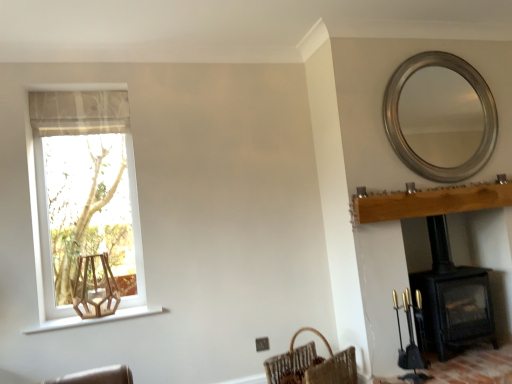
This screenshot has height=384, width=512. In order to click on wooden hexagonal swivel chair at lower left in this screenshot , I will do `click(95, 288)`.

What do you see at coordinates (441, 116) in the screenshot? I see `silver metallic mirror at upper right` at bounding box center [441, 116].

Locate an element on the screen. This screenshot has height=384, width=512. wooden hexagonal swivel chair at lower left is located at coordinates (95, 288).

Can you tell me how much brown woven basket at lower right and translucent fabric at left differ in facing direction?

They differ by 32.6 degrees in their facing directions.

From a real-world perspective, is brown woven basket at lower right physically below translucent fabric at left?

Yes, from a real-world perspective, brown woven basket at lower right is beneath translucent fabric at left.

Between brown woven basket at lower right and translucent fabric at left, which one is positioned behind?

translucent fabric at left is further from the camera.

In terms of width, does brown woven basket at lower right look wider or thinner when compared to translucent fabric at left?

Considering their sizes, brown woven basket at lower right looks broader than translucent fabric at left.

Is silver metallic mirror at upper right inside or outside of black matte wood burning stove at lower right?

silver metallic mirror at upper right cannot be found inside black matte wood burning stove at lower right.

Does silver metallic mirror at upper right lie in front of black matte wood burning stove at lower right?

No, silver metallic mirror at upper right is behind black matte wood burning stove at lower right.

Is point (415, 103) closer to viewer compared to point (417, 334)?

No, it is not.

This screenshot has width=512, height=384. Find the location of `mirror lying on the left of black matte wood burning stove at lower right`. mirror lying on the left of black matte wood burning stove at lower right is located at coordinates (441, 116).

Is black matte wood burning stove at lower right completely or partially outside of brown woven basket at lower right?

Absolutely, black matte wood burning stove at lower right is external to brown woven basket at lower right.

From the picture: From a real-world perspective, which object rests below the other?

brown woven basket at lower right.

Could you measure the distance between black matte wood burning stove at lower right and brown woven basket at lower right?

black matte wood burning stove at lower right and brown woven basket at lower right are 83.53 centimeters apart.

How different are the orientations of black matte wood burning stove at lower right and brown woven basket at lower right in degrees?

The angle between the facing direction of black matte wood burning stove at lower right and the facing direction of brown woven basket at lower right is 32.6 degrees.

Is brown woven basket at lower right further to camera compared to wooden hexagonal swivel chair at lower left?

No, brown woven basket at lower right is closer to the camera.

From the image's perspective, does brown woven basket at lower right appear higher than wooden hexagonal swivel chair at lower left?

No.

Can you see brown woven basket at lower right touching wooden hexagonal swivel chair at lower left?

No, brown woven basket at lower right is not making contact with wooden hexagonal swivel chair at lower left.

Does point (141, 283) come in front of point (441, 204)?

Yes.

Is translucent fabric at left inside or outside of light brown wood mantle at upper right?

translucent fabric at left is outside light brown wood mantle at upper right.

Considering the sizes of objects translucent fabric at left and light brown wood mantle at upper right in the image provided, who is thinner, translucent fabric at left or light brown wood mantle at upper right?

light brown wood mantle at upper right.

Is translucent fabric at left not near black matte wood burning stove at lower right?

translucent fabric at left is positioned a significant distance from black matte wood burning stove at lower right.

Between translucent fabric at left and black matte wood burning stove at lower right, which one has larger size?

translucent fabric at left is bigger.

Based on the photo, from a real-world perspective, which object rests below the other?

black matte wood burning stove at lower right.

Image resolution: width=512 pixels, height=384 pixels. I want to click on window that appears above the black matte wood burning stove at lower right (from the image's perspective), so click(83, 198).

Between light brown wood mantle at upper right and black matte wood burning stove at lower right, which one appears on the right side from the viewer's perspective?

black matte wood burning stove at lower right is more to the right.

From a real-world perspective, is light brown wood mantle at upper right physically located above or below black matte wood burning stove at lower right?

light brown wood mantle at upper right is above black matte wood burning stove at lower right.

Is the position of light brown wood mantle at upper right less distant than that of black matte wood burning stove at lower right?

Yes, light brown wood mantle at upper right is closer to the camera.

This screenshot has width=512, height=384. Find the location of `mantle that is in front of the black matte wood burning stove at lower right`. mantle that is in front of the black matte wood burning stove at lower right is located at coordinates (430, 201).

In order to click on window located above the brown woven basket at lower right (from the image's perspective) in this screenshot , I will do `click(83, 198)`.

Locate an element on the screen. wood burning stove that is below the silver metallic mirror at upper right (from the image's perspective) is located at coordinates (451, 298).

Which object lies nearer to the anchor point light brown wood mantle at upper right, silver metallic mirror at upper right or wooden hexagonal swivel chair at lower left?

silver metallic mirror at upper right.

Which object lies further to the anchor point brown woven basket at lower right, light brown wood mantle at upper right or silver metallic mirror at upper right?

Among the two, silver metallic mirror at upper right is located further to brown woven basket at lower right.

Estimate the real-world distances between objects in this image. Which object is further from black matte wood burning stove at lower right, brown woven basket at lower right or light brown wood mantle at upper right?

Based on the image, brown woven basket at lower right appears to be further to black matte wood burning stove at lower right.

When comparing their distances from wooden hexagonal swivel chair at lower left, does silver metallic mirror at upper right or translucent fabric at left seem closer?

translucent fabric at left lies closer to wooden hexagonal swivel chair at lower left than the other object.

When comparing their distances from translucent fabric at left, does wooden hexagonal swivel chair at lower left or brown woven basket at lower right seem closer?

wooden hexagonal swivel chair at lower left is closer to translucent fabric at left.

From the image, which object appears to be farther from translucent fabric at left, light brown wood mantle at upper right or wooden hexagonal swivel chair at lower left?

light brown wood mantle at upper right.

From the image, which object appears to be nearer to translucent fabric at left, wooden hexagonal swivel chair at lower left or silver metallic mirror at upper right?

wooden hexagonal swivel chair at lower left lies closer to translucent fabric at left than the other object.

From the image, which object appears to be farther from brown woven basket at lower right, black matte wood burning stove at lower right or wooden hexagonal swivel chair at lower left?

wooden hexagonal swivel chair at lower left.

I want to click on mantle situated between translucent fabric at left and black matte wood burning stove at lower right from left to right, so click(430, 201).

Identify the location of basket located between translucent fabric at left and silver metallic mirror at upper right in the left-right direction. This screenshot has height=384, width=512. (311, 365).

Find the location of a particular element. mantle between translucent fabric at left and silver metallic mirror at upper right is located at coordinates (430, 201).

The height and width of the screenshot is (384, 512). I want to click on swivel chair situated between translucent fabric at left and silver metallic mirror at upper right from left to right, so click(95, 288).